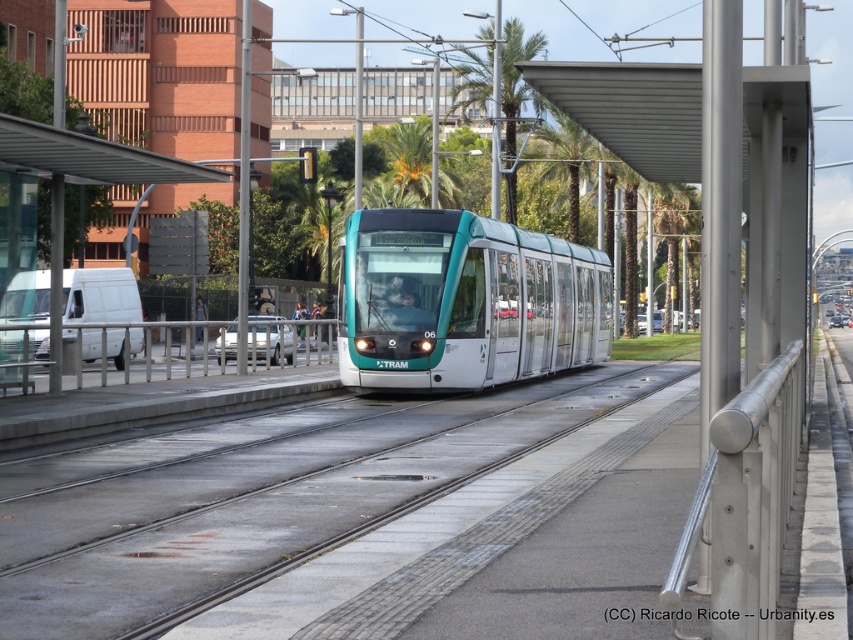
Question: Can you confirm if teal glossy tram at center is positioned to the right of silver metallic rail at right?

Choices:
 (A) yes
 (B) no

Answer: (A)

Question: Does teal glossy tram at center have a lesser width compared to metallic silver rail at center?

Choices:
 (A) yes
 (B) no

Answer: (A)

Question: Considering the real-world distances, which object is closest to the silver metallic rail at right?

Choices:
 (A) teal glossy tram at center
 (B) metallic silver rail at center

Answer: (A)

Question: In this image, where is teal glossy tram at center located relative to silver metallic rail at right?

Choices:
 (A) right
 (B) left

Answer: (A)

Question: Among these objects, which one is nearest to the camera?

Choices:
 (A) teal glossy tram at center
 (B) silver metallic rail at right

Answer: (B)

Question: Among these objects, which one is nearest to the camera?

Choices:
 (A) metallic silver rail at center
 (B) teal glossy tram at center

Answer: (A)